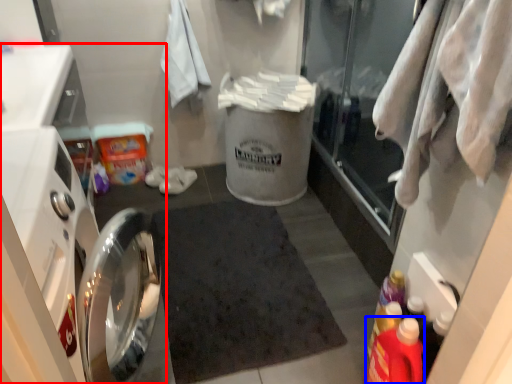
Question: Which object is closer to the camera taking this photo, dish washer (highlighted by a red box) or bottle (highlighted by a blue box)?

Choices:
 (A) dish washer
 (B) bottle

Answer: (A)